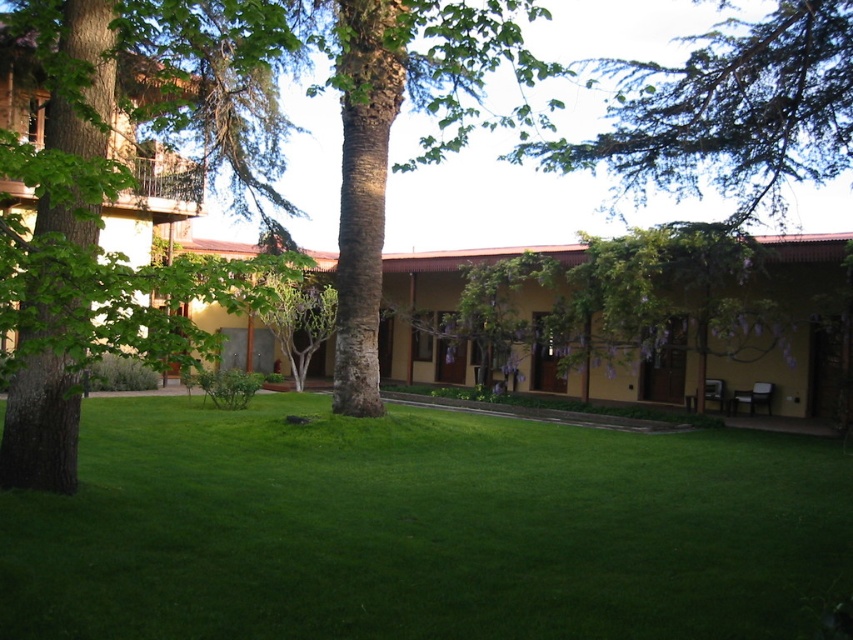
Question: Is green leafy tree at left further to camera compared to yellow matte building at center?

Choices:
 (A) yes
 (B) no

Answer: (B)

Question: Which object is farther from the camera taking this photo?

Choices:
 (A) green grass at center
 (B) yellow matte building at center
 (C) green leafy tree at left
 (D) green leafy tree at upper center

Answer: (B)

Question: Estimate the real-world distances between objects in this image. Which object is closer to the green leafy tree at left?

Choices:
 (A) yellow matte building at center
 (B) green leafy tree at upper center
 (C) green grass at center

Answer: (C)

Question: Which point appears closest to the camera in this image?

Choices:
 (A) (375, 508)
 (B) (20, 364)
 (C) (415, 273)
 (D) (755, 42)

Answer: (B)

Question: Does green grass at center have a larger size compared to green leafy tree at left?

Choices:
 (A) no
 (B) yes

Answer: (A)

Question: Is green leafy tree at left behind green leafy tree at upper center?

Choices:
 (A) yes
 (B) no

Answer: (B)